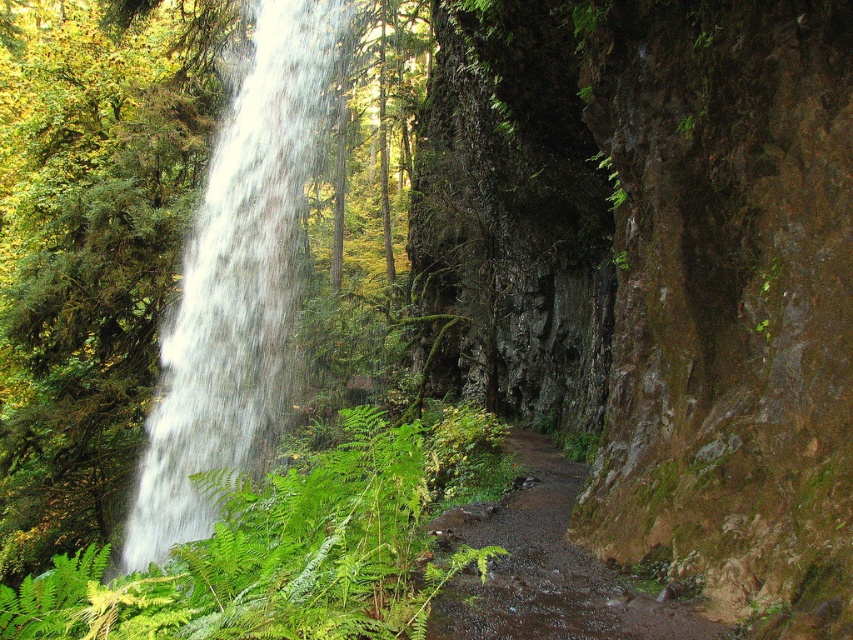
Question: Among these points, which one is farthest from the camera?

Choices:
 (A) (242, 109)
 (B) (476, 609)

Answer: (A)

Question: Can you confirm if white frothy water at left is thinner than damp dirt path at lower center?

Choices:
 (A) no
 (B) yes

Answer: (A)

Question: Is white frothy water at left closer to the viewer compared to damp dirt path at lower center?

Choices:
 (A) yes
 (B) no

Answer: (B)

Question: Can you confirm if white frothy water at left is wider than damp dirt path at lower center?

Choices:
 (A) no
 (B) yes

Answer: (B)